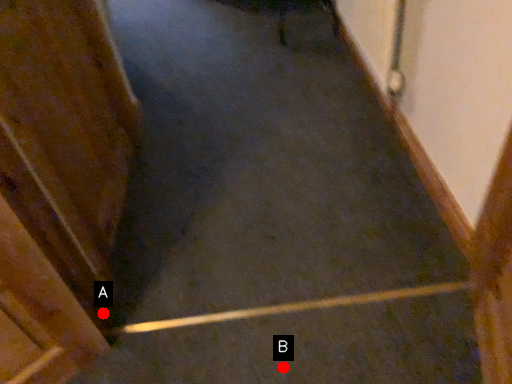
Question: Two points are circled on the image, labeled by A and B beside each circle. Which point is farther to the camera?

Choices:
 (A) A is further
 (B) B is further

Answer: (A)